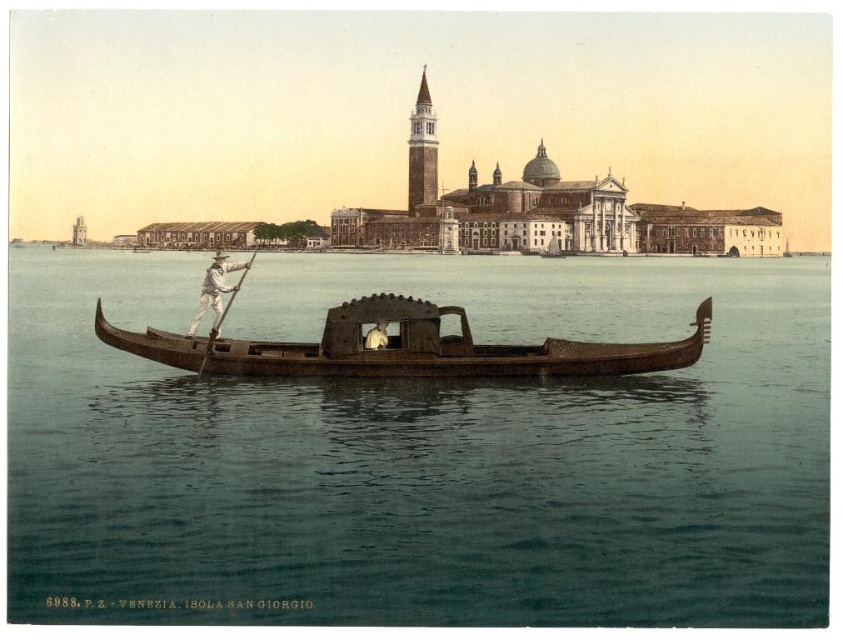
You are a tourist in Venice and want to take a photo of the wooden canoe at center while standing on the clear water at center. Is this possible?

The clear water at center is positioned under the wooden canoe at center, so you cannot stand on the clear water at center to take a photo of the wooden canoe at center because the water is under the canoe and not a solid surface.

You are a tourist standing on the dock in Venice and see the wooden canoe at center and the brown stone bell tower at upper center. Which object is closer to the water surface?

The wooden canoe at center is closer to the water surface than the brown stone bell tower at upper center because it is positioned below it.